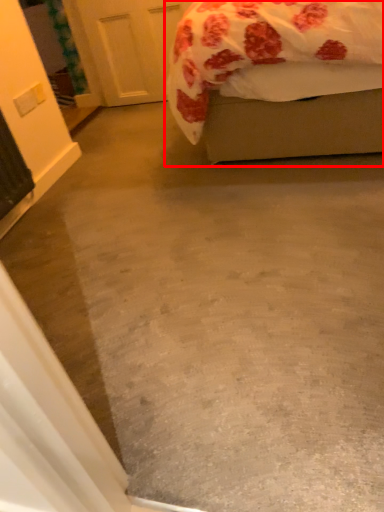
Question: From the image's perspective, what is the correct spatial relationship of bed (annotated by the red box) in relation to door?

Choices:
 (A) below
 (B) above

Answer: (A)